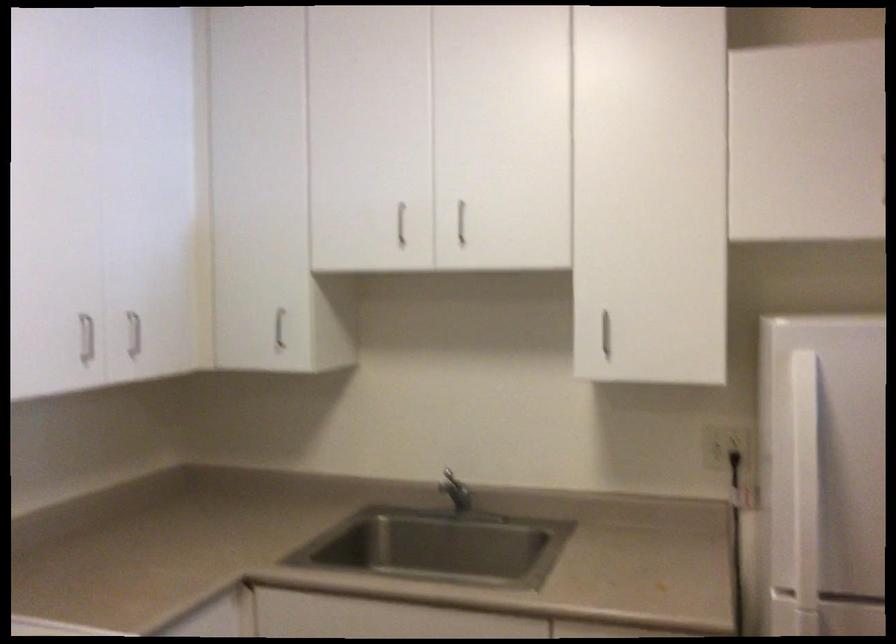
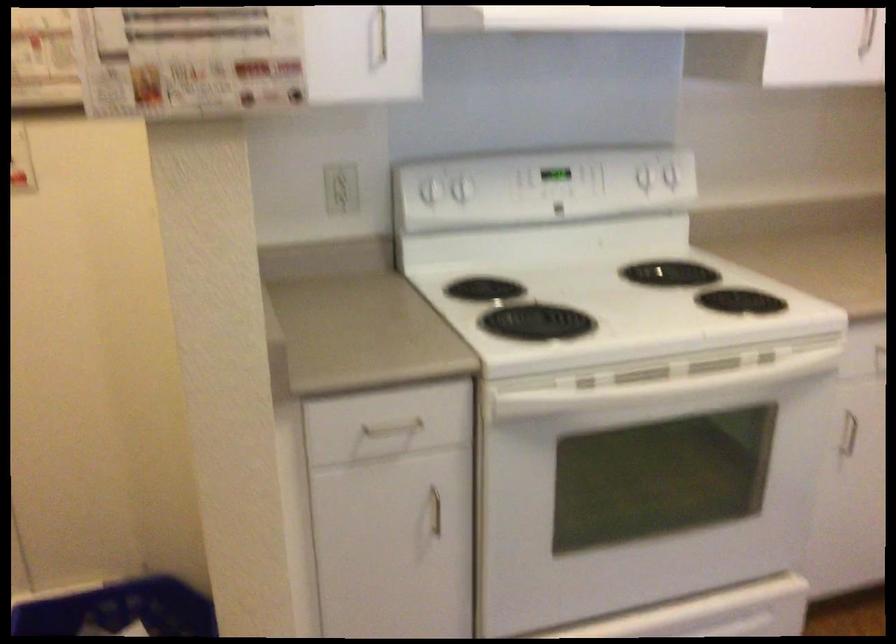
The first image is from the beginning of the video and the second image is from the end. How did the camera likely rotate when shooting the video?

The camera's rotation is toward left-down.